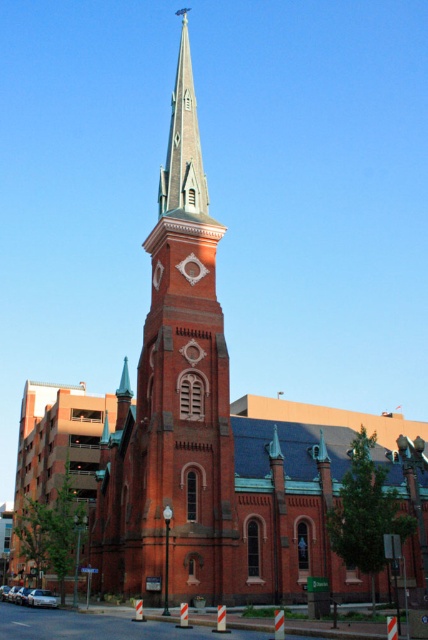
Question: Does brick steeple at center appear under smooth gray steeple at center?

Choices:
 (A) no
 (B) yes

Answer: (B)

Question: Does brick steeple at center have a greater width compared to smooth gray steeple at center?

Choices:
 (A) yes
 (B) no

Answer: (A)

Question: Which object appears farthest from the camera in this image?

Choices:
 (A) brick steeple at center
 (B) smooth gray steeple at center

Answer: (B)

Question: Which of the following is the closest to the observer?

Choices:
 (A) (231, 436)
 (B) (192, 205)

Answer: (A)

Question: Can you confirm if brick steeple at center is smaller than smooth gray steeple at center?

Choices:
 (A) no
 (B) yes

Answer: (A)

Question: Which point is closer to the camera?

Choices:
 (A) (193, 125)
 (B) (166, 433)

Answer: (B)